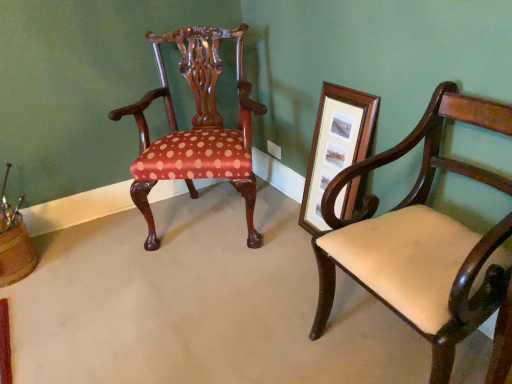
Describe the element at coordinates (196, 127) in the screenshot. I see `polished wood chair at center, arranged as the second chair when viewed from the front` at that location.

You are a GUI agent. You are given a task and a screenshot of the screen. Output one action in this format:
    pyautogui.click(x=<x>, y=<y>)
    Task: Click on the wooden picture frame at right
    The image size is (512, 384).
    Given the screenshot: What is the action you would take?
    pyautogui.click(x=335, y=145)

Are wooden picture frame at right and polished wood chair at center, the first chair from the back, making contact?

No, wooden picture frame at right is not next to polished wood chair at center, the first chair from the back.

Which is in front, point (321, 100) or point (201, 43)?

Positioned in front is point (321, 100).

Could you tell me if wooden picture frame at right is facing polished wood chair at center, the first chair from the back?

No, wooden picture frame at right does not turn towards polished wood chair at center, the first chair from the back.

Is wooden picture frame at right completely or partially outside of polished wood chair at center, arranged as the second chair when viewed from the front?

Yes, wooden picture frame at right is outside of polished wood chair at center, arranged as the second chair when viewed from the front.

How distant is matte cream upholstered chair at right, marked as the second chair in a left-to-right arrangement, from polished wood chair at center, which is counted as the second chair, starting from the right?

The distance of matte cream upholstered chair at right, marked as the second chair in a left-to-right arrangement, from polished wood chair at center, which is counted as the second chair, starting from the right, is 36.38 inches.

Where is `chair above the matte cream upholstered chair at right, the first chair in the right-to-left sequence (from the image's perspective)`? chair above the matte cream upholstered chair at right, the first chair in the right-to-left sequence (from the image's perspective) is located at coordinates (196, 127).

Between point (488, 254) and point (251, 161), which one is positioned in front?

The point (488, 254) is closer to the camera.

From a real-world perspective, who is located higher, matte cream upholstered chair at right, which ranks as the 1th chair in front-to-back order, or polished wood chair at center, which is counted as the 1th chair, starting from the left?

polished wood chair at center, which is counted as the 1th chair, starting from the left.

Are polished wood chair at center, which is counted as the second chair, starting from the right, and wooden picture frame at right located far from each other?

No.

From the image's perspective, is polished wood chair at center, which is counted as the second chair, starting from the right, on wooden picture frame at right?

Yes, from the image's perspective, polished wood chair at center, which is counted as the second chair, starting from the right, is on top of wooden picture frame at right.

Which point is more distant from viewer, (153, 42) or (352, 193)?

The point (153, 42) is behind.

Could you tell me if polished wood chair at center, arranged as the second chair when viewed from the front, is turned towards wooden picture frame at right?

No, polished wood chair at center, arranged as the second chair when viewed from the front, does not turn towards wooden picture frame at right.

Which point is more forward, [191,141] or [399,225]?

The point [399,225] is in front.

This screenshot has width=512, height=384. What are the coordinates of `chair that is under the polished wood chair at center, which is counted as the 1th chair, starting from the left (from a real-world perspective)` in the screenshot? It's located at (421, 240).

Between polished wood chair at center, which is counted as the second chair, starting from the right, and matte cream upholstered chair at right, marked as the second chair in a left-to-right arrangement, which one has larger width?

With larger width is polished wood chair at center, which is counted as the second chair, starting from the right.

Relative to matte cream upholstered chair at right, which ranks as the 1th chair in front-to-back order, is polished wood chair at center, the first chair from the back, in front or behind?

polished wood chair at center, the first chair from the back, is positioned farther from the viewer than matte cream upholstered chair at right, which ranks as the 1th chair in front-to-back order.

Consider the image. From the image's perspective, does wooden picture frame at right appear lower than matte cream upholstered chair at right, marked as the second chair in a left-to-right arrangement?

No.

Is wooden picture frame at right touching matte cream upholstered chair at right, which is counted as the second chair, starting from the back?

No.

Is wooden picture frame at right bigger than matte cream upholstered chair at right, which is counted as the second chair, starting from the back?

Incorrect, wooden picture frame at right is not larger than matte cream upholstered chair at right, which is counted as the second chair, starting from the back.

Between wooden picture frame at right and matte cream upholstered chair at right, which ranks as the 1th chair in front-to-back order, which one is positioned behind?

wooden picture frame at right is more distant.

From the image's perspective, which is above, matte cream upholstered chair at right, which is counted as the second chair, starting from the back, or wooden picture frame at right?

From the image's view, wooden picture frame at right is above.

Is matte cream upholstered chair at right, the first chair in the right-to-left sequence, at the left side of wooden picture frame at right?

Incorrect, matte cream upholstered chair at right, the first chair in the right-to-left sequence, is not on the left side of wooden picture frame at right.

Which of these two, matte cream upholstered chair at right, which ranks as the 1th chair in front-to-back order, or wooden picture frame at right, stands taller?

Standing taller between the two is matte cream upholstered chair at right, which ranks as the 1th chair in front-to-back order.

At what (x,y) coordinates should I click in order to perform the action: click on picture frame in front of the polished wood chair at center, arranged as the second chair when viewed from the front. Please return your answer as a coordinate pair (x, y). Looking at the image, I should click on (335, 145).

Where is `chair below the polished wood chair at center, arranged as the second chair when viewed from the front (from a real-world perspective)`? chair below the polished wood chair at center, arranged as the second chair when viewed from the front (from a real-world perspective) is located at coordinates (421, 240).

Looking at the image, which one is located further to polished wood chair at center, which is counted as the 1th chair, starting from the left, matte cream upholstered chair at right, which ranks as the 1th chair in front-to-back order, or wooden picture frame at right?

Among the two, matte cream upholstered chair at right, which ranks as the 1th chair in front-to-back order, is located further to polished wood chair at center, which is counted as the 1th chair, starting from the left.

Which object lies further to the anchor point polished wood chair at center, arranged as the second chair when viewed from the front, wooden picture frame at right or matte cream upholstered chair at right, which is counted as the second chair, starting from the back?

Among the two, matte cream upholstered chair at right, which is counted as the second chair, starting from the back, is located further to polished wood chair at center, arranged as the second chair when viewed from the front.

From the image, which object appears to be nearer to wooden picture frame at right, matte cream upholstered chair at right, the first chair in the right-to-left sequence, or polished wood chair at center, arranged as the second chair when viewed from the front?

Among the two, matte cream upholstered chair at right, the first chair in the right-to-left sequence, is located nearer to wooden picture frame at right.

When comparing their distances from matte cream upholstered chair at right, which is counted as the second chair, starting from the back, does polished wood chair at center, arranged as the second chair when viewed from the front, or wooden picture frame at right seem closer?

wooden picture frame at right is positioned closer to the anchor matte cream upholstered chair at right, which is counted as the second chair, starting from the back.

Based on their spatial positions, is wooden picture frame at right or polished wood chair at center, which is counted as the second chair, starting from the right, further from matte cream upholstered chair at right, which is counted as the second chair, starting from the back?

polished wood chair at center, which is counted as the second chair, starting from the right.

Based on their spatial positions, is polished wood chair at center, arranged as the second chair when viewed from the front, or matte cream upholstered chair at right, which is counted as the second chair, starting from the back, closer to wooden picture frame at right?

matte cream upholstered chair at right, which is counted as the second chair, starting from the back.

Where is `picture frame between matte cream upholstered chair at right, the first chair in the right-to-left sequence, and polished wood chair at center, which is counted as the second chair, starting from the right, in the front-back direction`? This screenshot has width=512, height=384. picture frame between matte cream upholstered chair at right, the first chair in the right-to-left sequence, and polished wood chair at center, which is counted as the second chair, starting from the right, in the front-back direction is located at coordinates (335, 145).